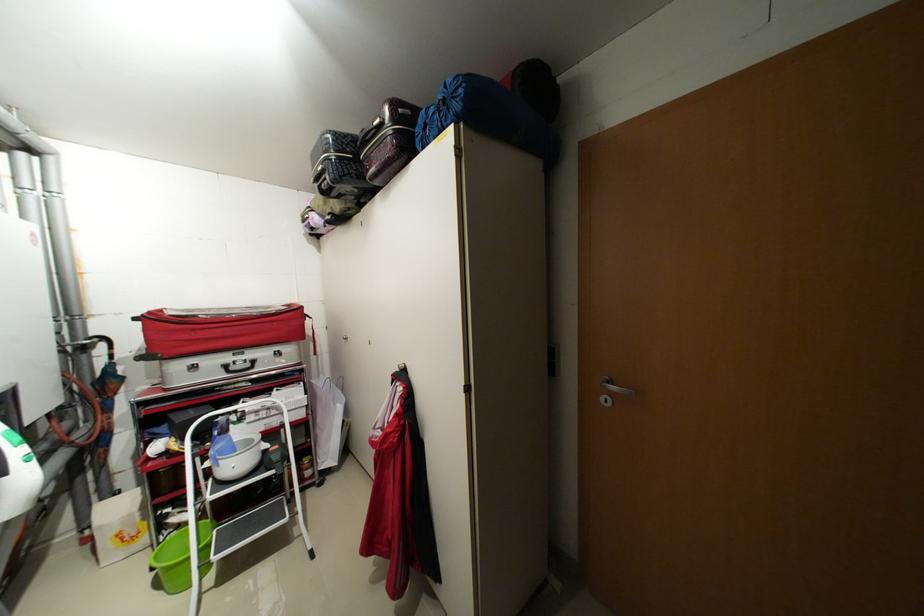
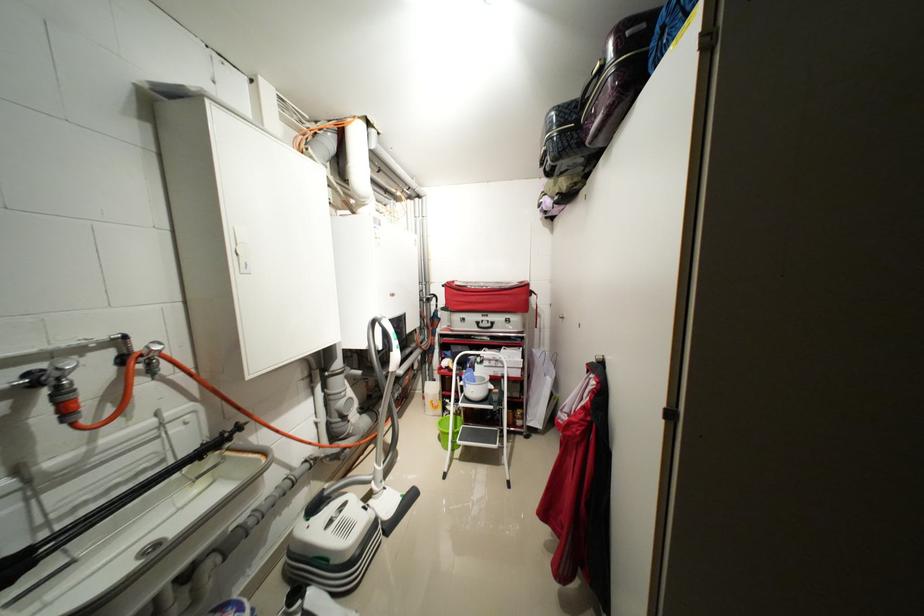
Locate, in the second image, the point that corresponds to point 157,314 in the first image.

(455, 284)